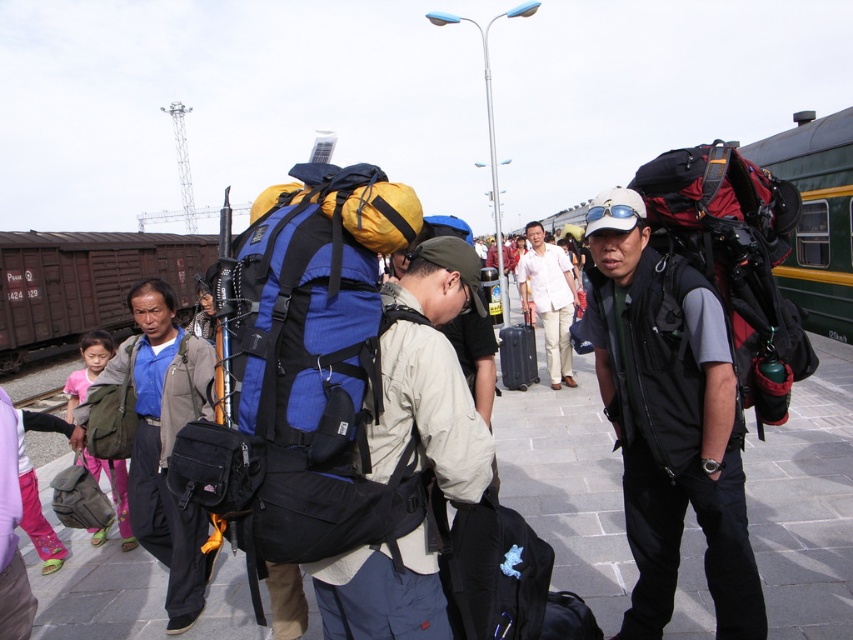
Question: Which of these objects is positioned closest to the brown wooden train at left?

Choices:
 (A) matte black bag at left
 (B) matte black backpack at right

Answer: (A)

Question: Where is matte green backpack at left located in relation to metal train track at lower left in the image?

Choices:
 (A) left
 (B) right

Answer: (B)

Question: Can you confirm if matte black backpack at right is wider than white cotton shirt at center?

Choices:
 (A) no
 (B) yes

Answer: (A)

Question: Which is farther from the matte green backpack at left?

Choices:
 (A) matte black backpack at right
 (B) black hardshell suitcase at center
 (C) matte black bag at left

Answer: (B)

Question: Which object is positioned closest to the metal train track at lower left?

Choices:
 (A) brown wooden train at left
 (B) black hardshell suitcase at center
 (C) matte black bag at left
 (D) matte green backpack at left

Answer: (A)

Question: Does matte black backpack at right lie in front of matte black bag at left?

Choices:
 (A) yes
 (B) no

Answer: (A)